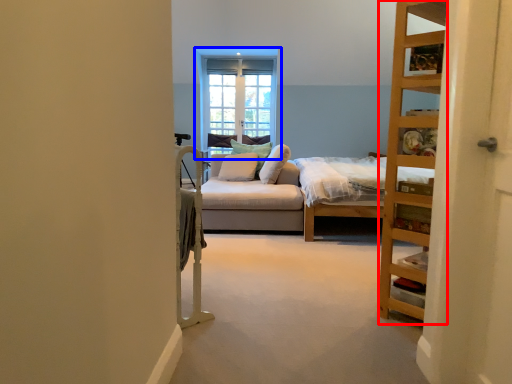
Question: Among these objects, which one is farthest to the camera, shelf (highlighted by a red box) or window (highlighted by a blue box)?

Choices:
 (A) shelf
 (B) window

Answer: (B)